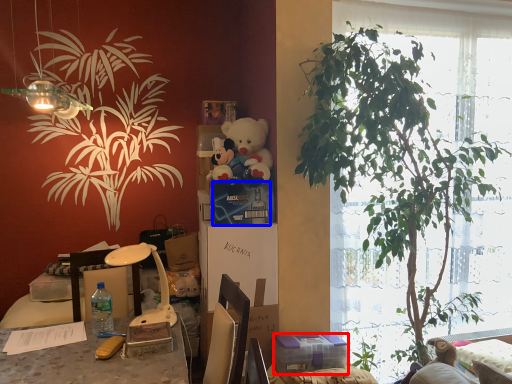
Question: Which object appears closest to the camera in this image, box (highlighted by a red box) or box (highlighted by a blue box)?

Choices:
 (A) box
 (B) box

Answer: (A)